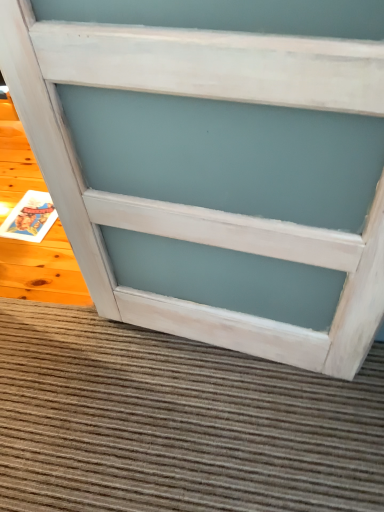
Identify the location of free space to the left of white painted wood cabinet at lower center. (87, 384).